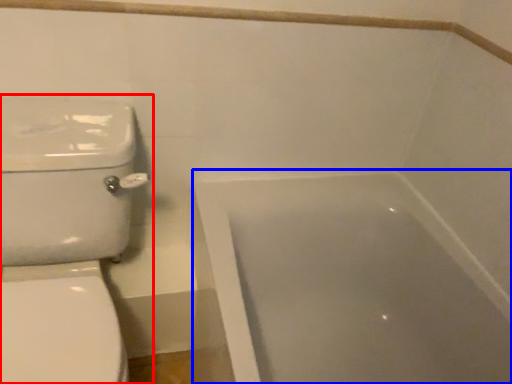
Question: Which point is further to the camera, toilet (highlighted by a red box) or bathtub (highlighted by a blue box)?

Choices:
 (A) toilet
 (B) bathtub

Answer: (B)